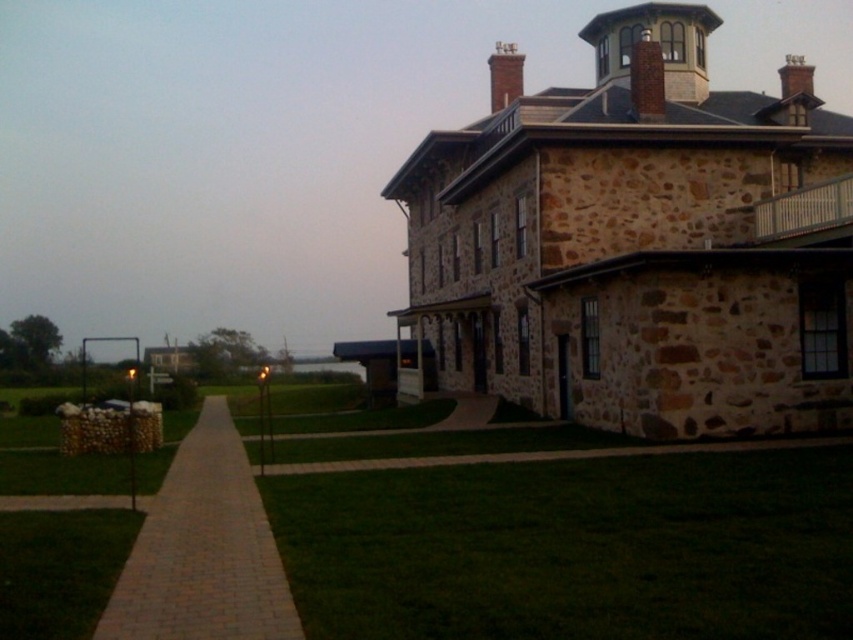
Question: Can you confirm if green grass at lower center is bigger than green grass at lower left?

Choices:
 (A) yes
 (B) no

Answer: (A)

Question: From the image, what is the correct spatial relationship of brown stone tower at upper right in relation to green grass at lower left?

Choices:
 (A) right
 (B) left

Answer: (A)

Question: From the image, what is the correct spatial relationship of brown stone tower at upper right in relation to green grass at lower left?

Choices:
 (A) above
 (B) below

Answer: (A)

Question: Considering the real-world distances, which object is closest to the brown stone tower at upper right?

Choices:
 (A) green grass at lower center
 (B) green grass at lower left
 (C) brick paved path at lower left

Answer: (A)

Question: Which object is positioned closest to the green grass at lower center?

Choices:
 (A) brick paved path at lower left
 (B) brown stone tower at upper right
 (C) green grass at lower left

Answer: (A)

Question: Which object is positioned closest to the green grass at lower center?

Choices:
 (A) green grass at lower left
 (B) brown stone tower at upper right

Answer: (A)